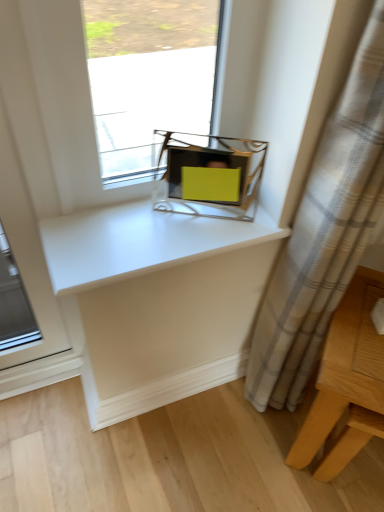
The height and width of the screenshot is (512, 384). Identify the location of free location to the right of matte yellow plastic at center. [x=254, y=219].